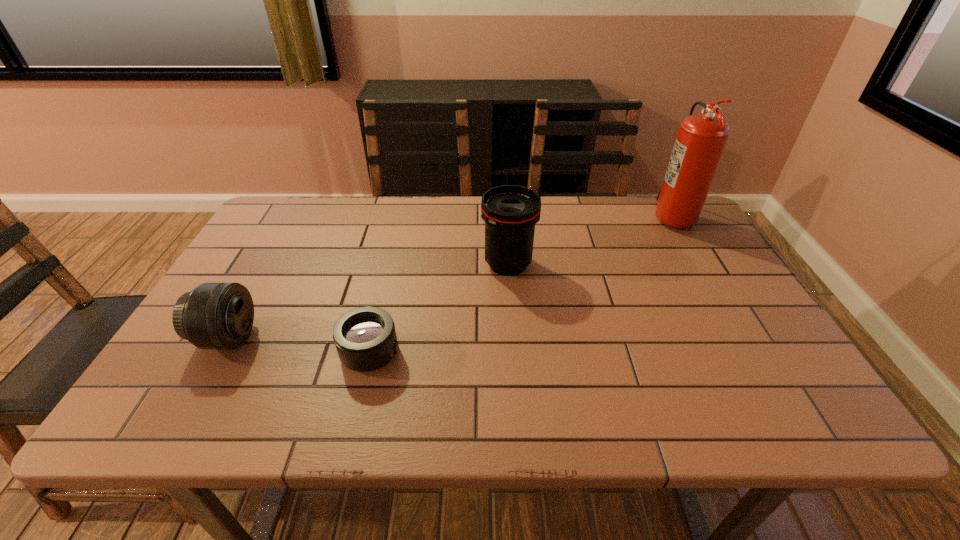
Find the location of `unoccupied area between the tallest object and the second shortest telephoto lens`. unoccupied area between the tallest object and the second shortest telephoto lens is located at coordinates (449, 276).

Select which object is the second closest to the second object from left to right. Please provide its 2D coordinates. Your answer should be formatted as a tuple, i.e. [(x, y)], where the tuple contains the x and y coordinates of a point satisfying the conditions above.

[(510, 212)]

The image size is (960, 540). I want to click on object that can be found as the second closest to the third tallest object, so click(510, 212).

Identify the location of telephoto lens that is the closest to the tallest telephoto lens. (365, 338).

You are a GUI agent. You are given a task and a screenshot of the screen. Output one action in this format:
    pyautogui.click(x=<x>, y=<y>)
    Task: Click on the second closest telephoto lens to the second telephoto lens from left to right
    The image size is (960, 540).
    Given the screenshot: What is the action you would take?
    pyautogui.click(x=510, y=212)

You are a GUI agent. You are given a task and a screenshot of the screen. Output one action in this format:
    pyautogui.click(x=<x>, y=<y>)
    Task: Click on the vacant position in the image that satisfies the following two spatial constraints: 1. on the front side of the farthest telephoto lens; 2. on the front-facing side of the leftmost telephoto lens
    The height and width of the screenshot is (540, 960).
    Given the screenshot: What is the action you would take?
    pyautogui.click(x=514, y=338)

I want to click on vacant region that satisfies the following two spatial constraints: 1. on the front side of the tallest telephoto lens; 2. on the front-facing side of the leftmost object, so click(x=514, y=338).

This screenshot has width=960, height=540. I want to click on free point that satisfies the following two spatial constraints: 1. on the instruction side of the farthest object; 2. on the front side of the second farthest object, so click(700, 264).

Locate an element on the screen. The image size is (960, 540). free location that satisfies the following two spatial constraints: 1. on the front side of the tallest telephoto lens; 2. on the front-facing side of the leftmost object is located at coordinates (514, 338).